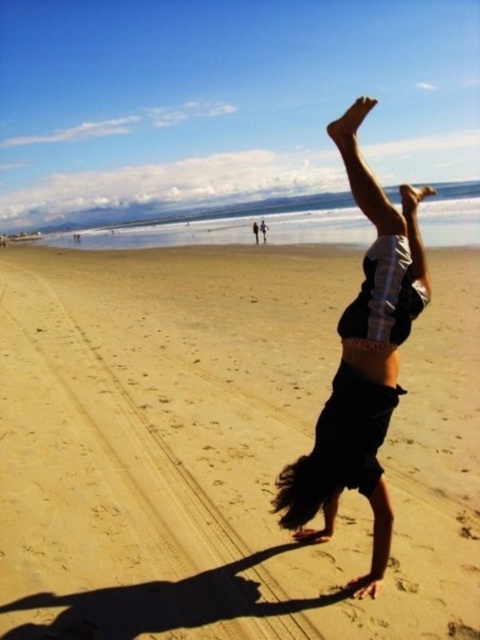
You are a photographer trying to capture the perfect shot of the sandy yellow at center and the dark brown hair at center. Which object should you focus on first if you want to ensure both are in sharp focus?

The sandy yellow at center is much taller than the dark brown hair at center, so focusing on the sandy yellow at center first will help ensure both are in sharp focus as it is the taller object.

You are standing at the point marked by coordinates point (218, 449). Looking around, what color do you see directly beneath your feet?

The point (218, 449) marks sandy yellow at center, so you would see sandy yellow beneath your feet.

You are a photographer trying to capture the perfect shot of the person doing a handstand. You notice the sandy yellow at center and the dark brown hair at center. Which object in the scene should you focus on to ensure the subject is clearly visible against the background?

The sandy yellow at center has a larger size compared to dark brown hair at center, so focusing on the sandy yellow at center would ensure the subject is clearly visible against the background due to its prominence in size.